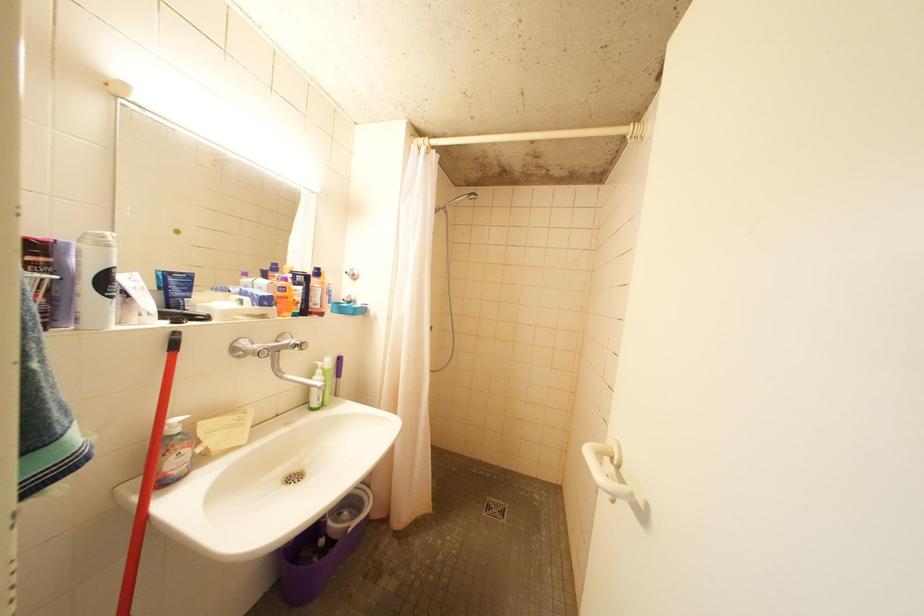
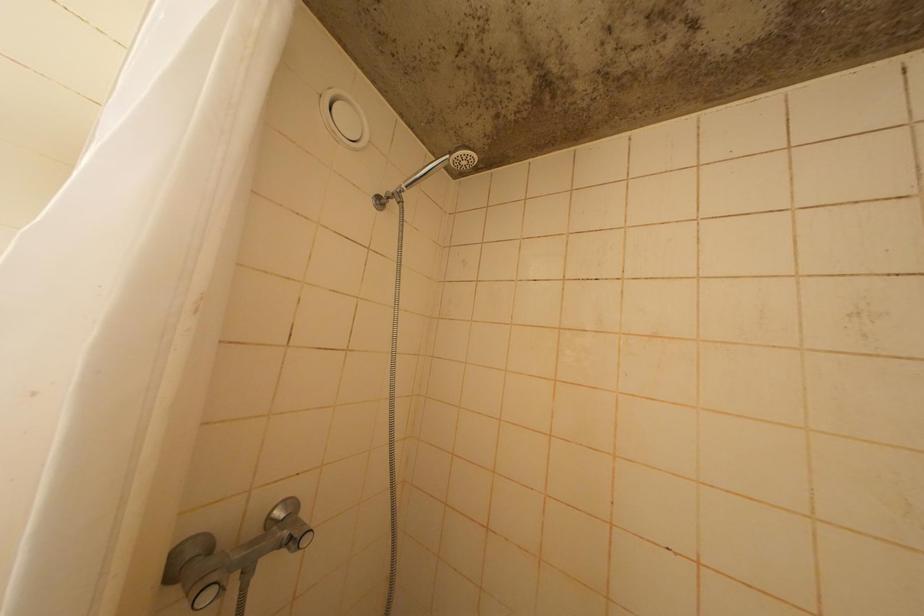
Question: In a continuous first-person perspective shot, in which direction is the camera moving?

Choices:
 (A) Left
 (B) Right
 (C) Forward
 (D) Backward

Answer: (C)